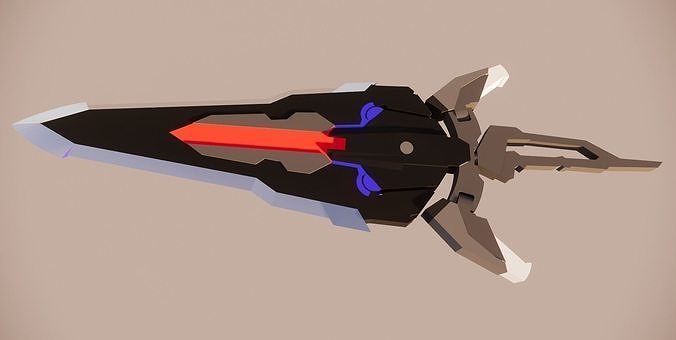
Where is `handle`? The height and width of the screenshot is (340, 676). handle is located at coordinates (579, 140).